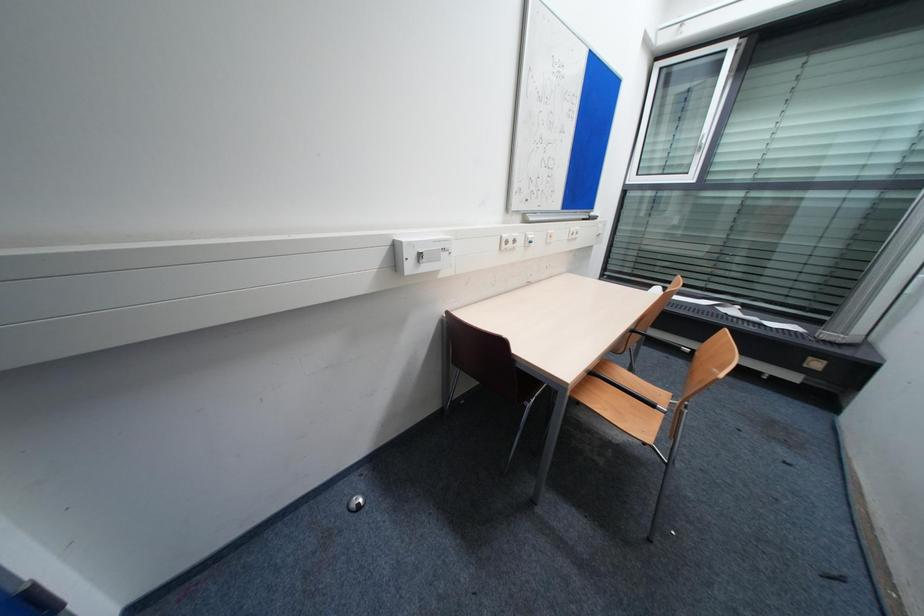
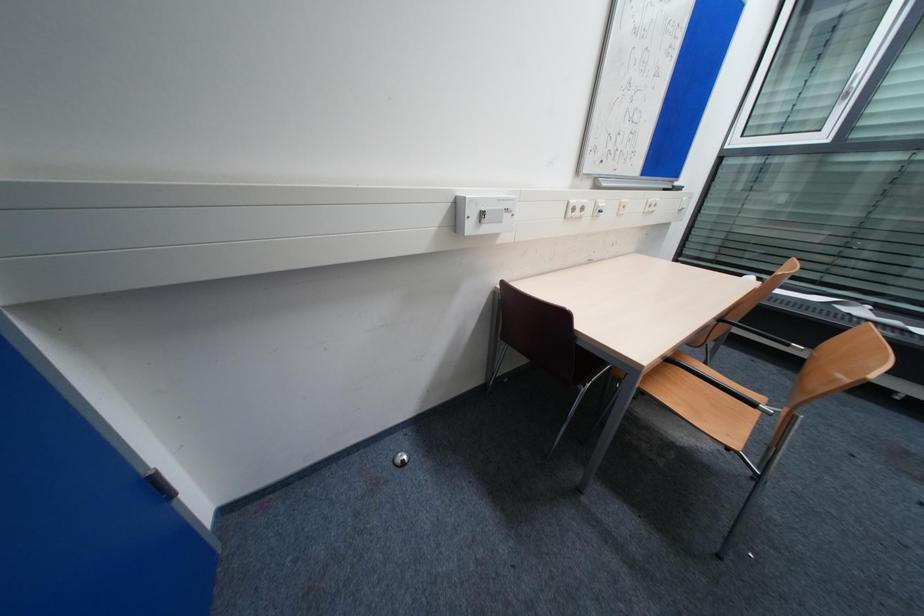
Which direction would the cameraman need to move to produce the second image?

The cameraman moved toward left, forward.